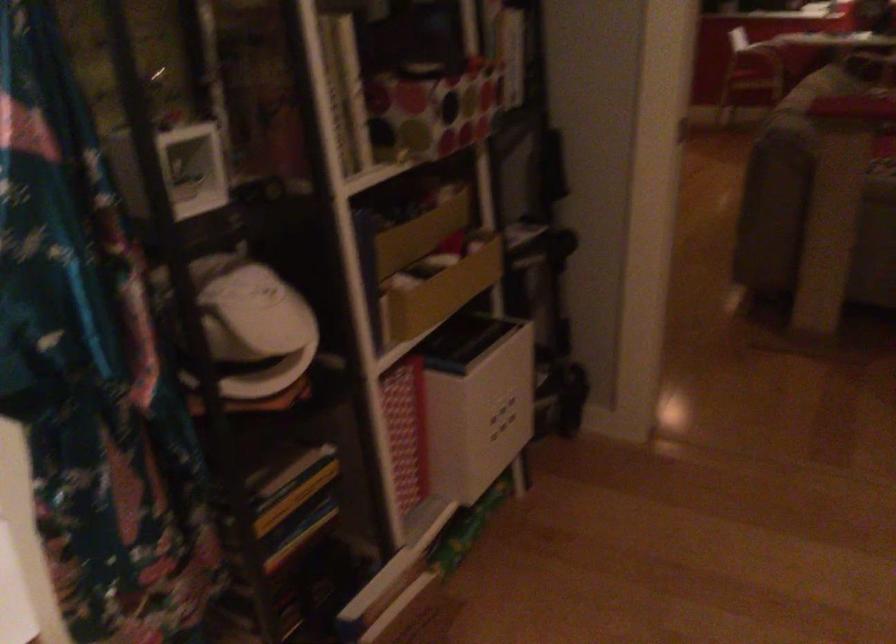
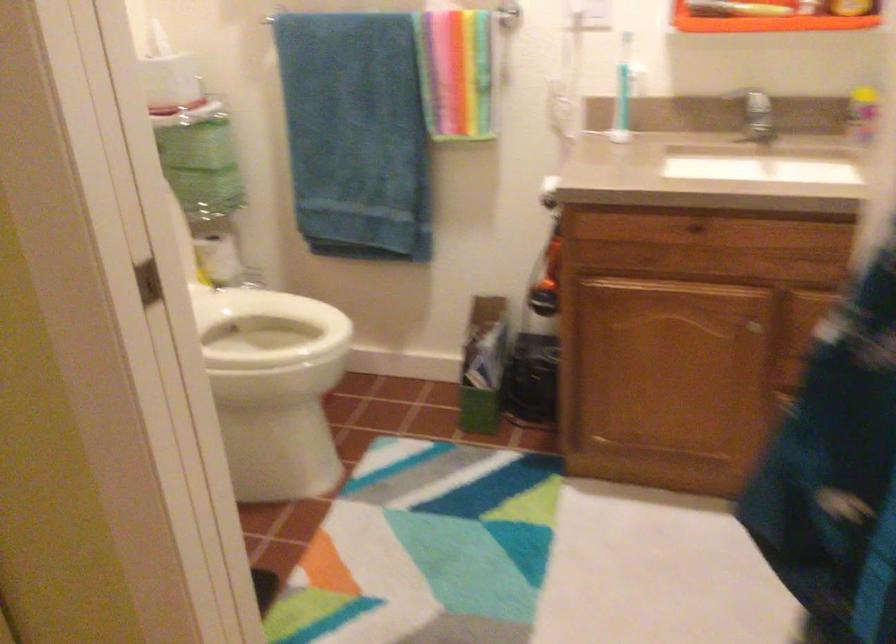
First-person continuous shooting, in which direction is the camera rotating?

The rotation direction of the camera is left-down.